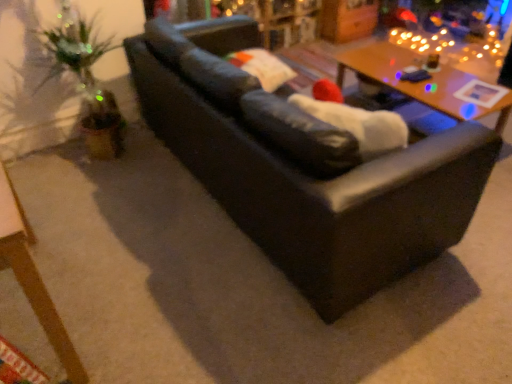
At what (x,y) coordinates should I click in order to perform the action: click on free space to the left of matte black couch at center. Please return your answer as a coordinate pair (x, y). The image size is (512, 384). Looking at the image, I should click on (112, 201).